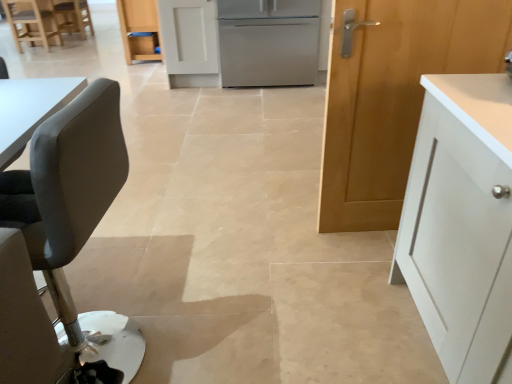
Question: Is stainless steel refrigerator at center at the back of matte gray chair at upper left, marked as the second chair in a bottom-to-top arrangement?

Choices:
 (A) no
 (B) yes

Answer: (A)

Question: Considering the relative sizes of matte gray chair at upper left, placed as the 1th chair when sorted from left to right, and stainless steel refrigerator at center in the image provided, is matte gray chair at upper left, placed as the 1th chair when sorted from left to right, wider than stainless steel refrigerator at center?

Choices:
 (A) no
 (B) yes

Answer: (A)

Question: Is matte gray chair at upper left, placed as the 1th chair when sorted from left to right, not close to stainless steel refrigerator at center?

Choices:
 (A) yes
 (B) no

Answer: (A)

Question: From the image's perspective, does matte gray chair at upper left, the third chair when ordered from right to left, appear lower than stainless steel refrigerator at center?

Choices:
 (A) yes
 (B) no

Answer: (B)

Question: From a real-world perspective, is matte gray chair at upper left, placed as the 1th chair when sorted from left to right, located beneath stainless steel refrigerator at center?

Choices:
 (A) yes
 (B) no

Answer: (A)

Question: From the image's perspective, is wooden door at right, which ranks as the 2th cabinetry in back-to-front order, positioned above or below matte wood cabinet at center, the second cabinetry in the bottom-to-top sequence?

Choices:
 (A) below
 (B) above

Answer: (A)

Question: Is wooden door at right, which is the first cabinetry in right-to-left order, taller or shorter than matte wood cabinet at center, positioned as the 2th cabinetry in right-to-left order?

Choices:
 (A) tall
 (B) short

Answer: (A)

Question: Considering the positions of wooden door at right, which ranks as the 2th cabinetry in back-to-front order, and matte wood cabinet at center, the second cabinetry in the bottom-to-top sequence, in the image, is wooden door at right, which ranks as the 2th cabinetry in back-to-front order, wider or thinner than matte wood cabinet at center, the second cabinetry in the bottom-to-top sequence,?

Choices:
 (A) wide
 (B) thin

Answer: (B)

Question: Do you think wooden door at right, the 2th cabinetry viewed from the left, is within matte wood cabinet at center, the 1th cabinetry from the left, or outside of it?

Choices:
 (A) outside
 (B) inside

Answer: (A)

Question: Do you think wooden chair at upper left, acting as the 2th chair starting from the right, is within wooden door at right, which appears as the 2th cabinetry when viewed from the top, or outside of it?

Choices:
 (A) outside
 (B) inside

Answer: (A)

Question: Would you say wooden chair at upper left, marked as the 3th chair in a bottom-to-top arrangement, is to the left or to the right of wooden door at right, placed as the first cabinetry when sorted from front to back, in the picture?

Choices:
 (A) right
 (B) left

Answer: (B)

Question: In the image, is wooden chair at upper left, which appears as the 1th chair when viewed from the back, positioned in front of or behind wooden door at right, the 2th cabinetry viewed from the left?

Choices:
 (A) behind
 (B) front

Answer: (A)

Question: In terms of height, does wooden chair at upper left, the third chair when ordered from front to back, look taller or shorter compared to wooden door at right, which ranks as the 2th cabinetry in back-to-front order?

Choices:
 (A) tall
 (B) short

Answer: (B)

Question: Considering the positions of matte gray chair at upper left, placed as the 1th chair when sorted from left to right, and wooden chair at upper left, the third chair when ordered from front to back, in the image, is matte gray chair at upper left, placed as the 1th chair when sorted from left to right, wider or thinner than wooden chair at upper left, the third chair when ordered from front to back,?

Choices:
 (A) thin
 (B) wide

Answer: (B)

Question: In terms of height, does matte gray chair at upper left, placed as the 1th chair when sorted from left to right, look taller or shorter compared to wooden chair at upper left, the second chair positioned from the left?

Choices:
 (A) tall
 (B) short

Answer: (A)